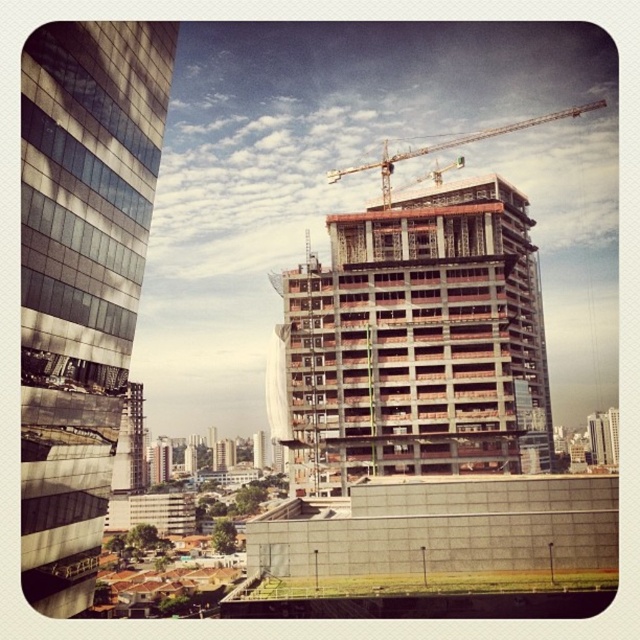
Which is more to the right, reflective glass building at left or concrete tower at center?

Positioned to the right is reflective glass building at left.

Is reflective glass building at left further to the viewer compared to concrete tower at center?

No.

Measure the distance between reflective glass building at left and camera.

reflective glass building at left is 38.75 meters from camera.

Where is `reflective glass building at left`? The width and height of the screenshot is (640, 640). reflective glass building at left is located at coordinates (81, 278).

Does reflective glass building at left appear under metallic construction crane at upper center?

Yes, reflective glass building at left is below metallic construction crane at upper center.

Describe the element at coordinates (81, 278) in the screenshot. I see `reflective glass building at left` at that location.

Locate an element on the screen. The height and width of the screenshot is (640, 640). reflective glass building at left is located at coordinates (81, 278).

Can you confirm if concrete building at center is positioned to the right of metallic construction crane at upper center?

In fact, concrete building at center is to the left of metallic construction crane at upper center.

Is concrete building at center thinner than metallic construction crane at upper center?

Yes, concrete building at center is thinner than metallic construction crane at upper center.

Is point (372, 276) positioned after point (410, 156)?

No.

You are a GUI agent. You are given a task and a screenshot of the screen. Output one action in this format:
    pyautogui.click(x=<x>, y=<y>)
    Task: Click on the concrete building at center
    Image resolution: width=640 pixels, height=640 pixels.
    Given the screenshot: What is the action you would take?
    pyautogui.click(x=416, y=340)